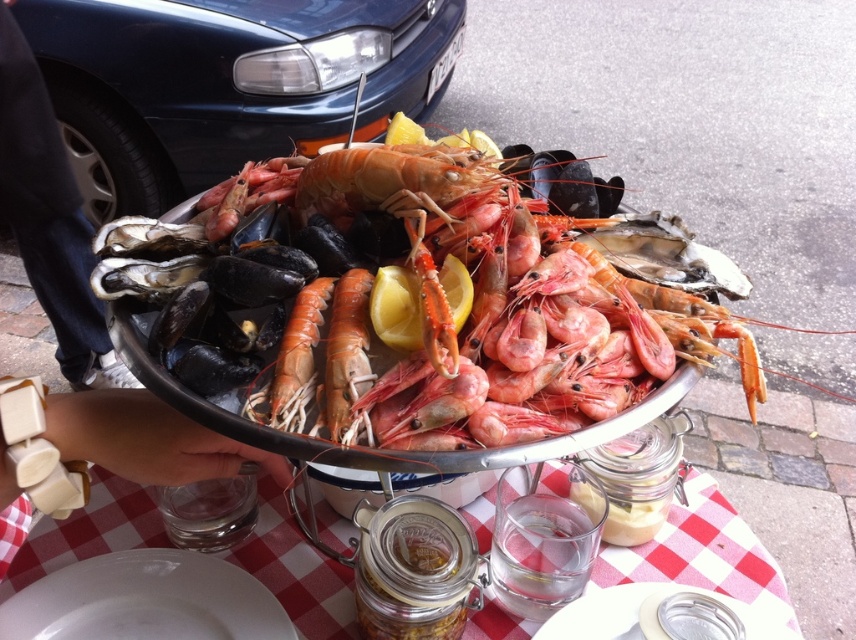
Does white ceramic table at center have a larger size compared to white leather bracelet at lower left?

Correct, white ceramic table at center is larger in size than white leather bracelet at lower left.

Who is positioned more to the left, white ceramic table at center or white leather bracelet at lower left?

From the viewer's perspective, white leather bracelet at lower left appears more on the left side.

Which is in front, point (135, 512) or point (122, 474)?

Positioned in front is point (122, 474).

Identify the location of white ceramic table at center. (700, 554).

Can you confirm if pink glossy shrimp at center is taller than white ceramic plate at lower left?

Indeed, pink glossy shrimp at center has a greater height compared to white ceramic plate at lower left.

Does point (360, 228) come closer to viewer compared to point (107, 570)?

Yes, point (360, 228) is in front of point (107, 570).

Image resolution: width=856 pixels, height=640 pixels. I want to click on pink glossy shrimp at center, so click(x=412, y=291).

Who is shorter, black fabric pants at lower left or pink matte shrimp at center?

pink matte shrimp at center is shorter.

Based on the photo, does black fabric pants at lower left appear on the right side of pink matte shrimp at center?

Incorrect, black fabric pants at lower left is not on the right side of pink matte shrimp at center.

Locate an element on the screen. black fabric pants at lower left is located at coordinates tap(51, 218).

Image resolution: width=856 pixels, height=640 pixels. In order to click on black fabric pants at lower left in this screenshot , I will do `click(51, 218)`.